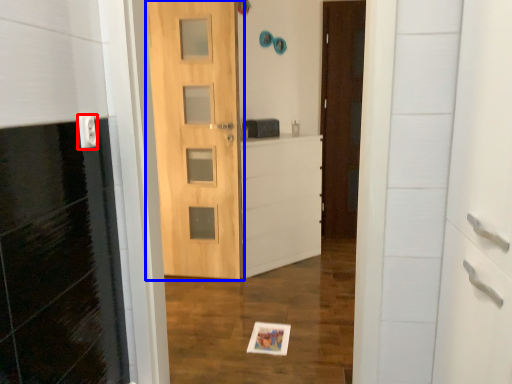
Question: Which point is further to the camera, electric outlet (highlighted by a red box) or door (highlighted by a blue box)?

Choices:
 (A) electric outlet
 (B) door

Answer: (B)